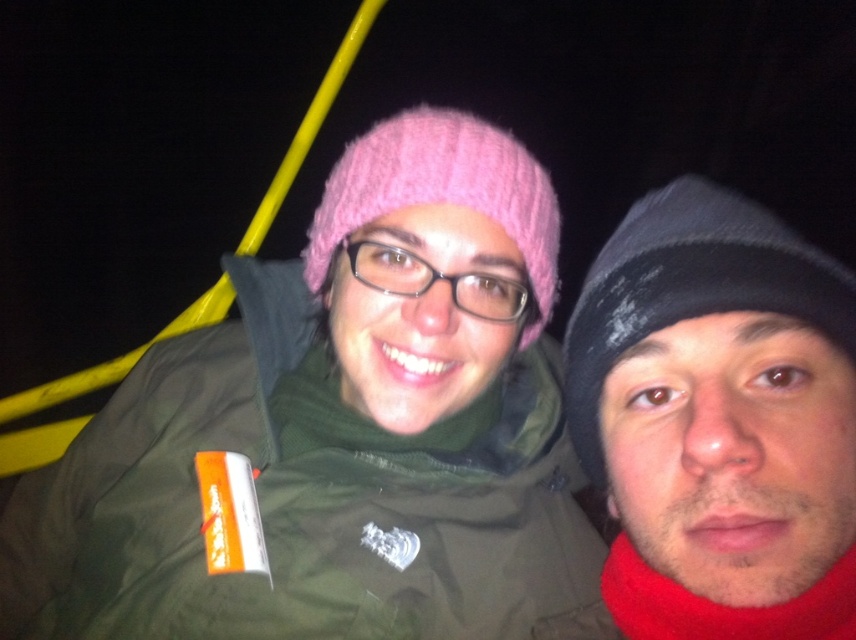
You are standing in front of the two people in the image. You want to throw a small ball to the point that is closer to you. Which point should you aim for, point (x=595, y=317) or point (x=503, y=182)?

You should aim for point (x=595, y=317) because it is closer to you than point (x=503, y=182) according to the description.

You are a photographer trying to capture a clear shot of both the black knit beanie at right and the pink knitted hat at center. Which hat should you focus on first to ensure it takes up more of the frame?

The pink knitted hat at center occupies more space than the black knit beanie at right, so you should focus on the pink knitted hat at center first to ensure it takes up more of the frame.

In the scene shown: You are a photographer trying to capture a closeup of both the black knit beanie at right and the pink knitted hat at center in the scene. Given that your camera can only focus on objects within a 5 inch range, will you be able to get both in focus?

The black knit beanie at right and pink knitted hat at center are 6.32 inches apart from each other. Since the distance between them exceeds the 5 inch focus range, the camera cannot keep both in focus simultaneously.